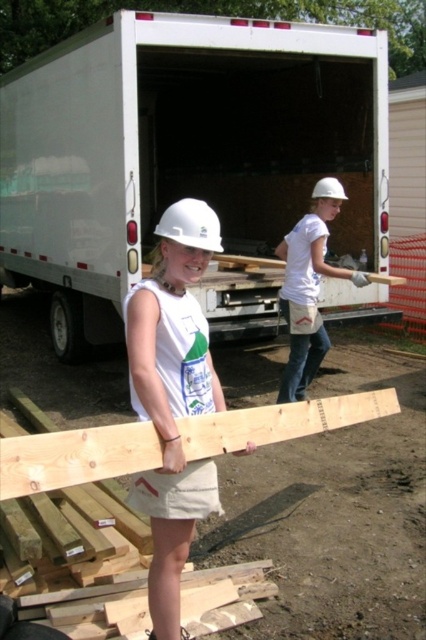
Which is behind, point (45, 467) or point (195, 218)?

The point (195, 218) is behind.

Locate an element on the screen. This screenshot has width=426, height=640. natural wood plank at center is located at coordinates (75, 456).

The width and height of the screenshot is (426, 640). Describe the element at coordinates (183, 148) in the screenshot. I see `white matte truck at center` at that location.

Image resolution: width=426 pixels, height=640 pixels. What do you see at coordinates (183, 148) in the screenshot?
I see `white matte truck at center` at bounding box center [183, 148].

You are a GUI agent. You are given a task and a screenshot of the screen. Output one action in this format:
    pyautogui.click(x=<x>, y=<y>)
    Task: Click on the white matte truck at center
    The width and height of the screenshot is (426, 640).
    Given the screenshot: What is the action you would take?
    tap(183, 148)

Is white matte hard hat at center positioned before white matte hard hat at upper center?

Yes, white matte hard hat at center is closer to the viewer.

Which is in front, point (155, 637) or point (305, 321)?

Positioned in front is point (155, 637).

The width and height of the screenshot is (426, 640). In order to click on white matte hard hat at center in this screenshot , I will do `click(172, 396)`.